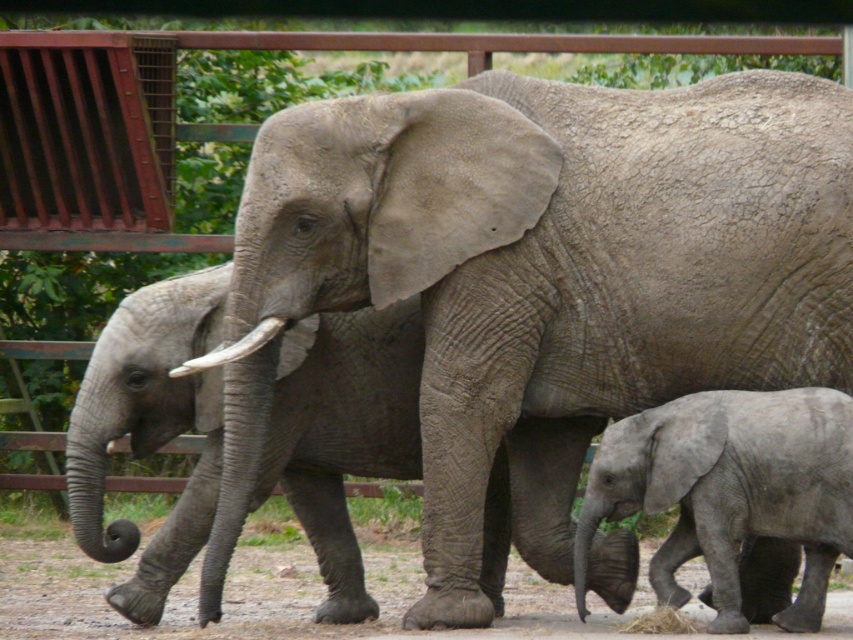
Question: Which object is farther from the camera taking this photo?

Choices:
 (A) gray rough elephant at center
 (B) gray wrinkled elephant at center
 (C) brown dirt field at lower center

Answer: (B)

Question: Is gray wrinkled elephant at center above gray matte elephant at lower right?

Choices:
 (A) no
 (B) yes

Answer: (B)

Question: Can you confirm if gray wrinkled elephant at center is bigger than gray matte elephant at lower right?

Choices:
 (A) yes
 (B) no

Answer: (A)

Question: Among these points, which one is farthest from the camera?

Choices:
 (A) (524, 586)
 (B) (703, 164)

Answer: (A)

Question: Does gray rough elephant at center appear under gray matte elephant at lower right?

Choices:
 (A) no
 (B) yes

Answer: (A)

Question: Which object is positioned closest to the gray wrinkled elephant at center?

Choices:
 (A) brown dirt field at lower center
 (B) gray matte elephant at lower right

Answer: (A)